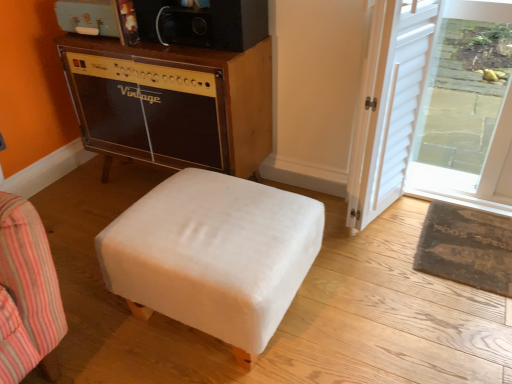
Where is `empty space that is ontop of rustic brown mat at lower right (from a real-world perspective)`? empty space that is ontop of rustic brown mat at lower right (from a real-world perspective) is located at coordinates coord(471,236).